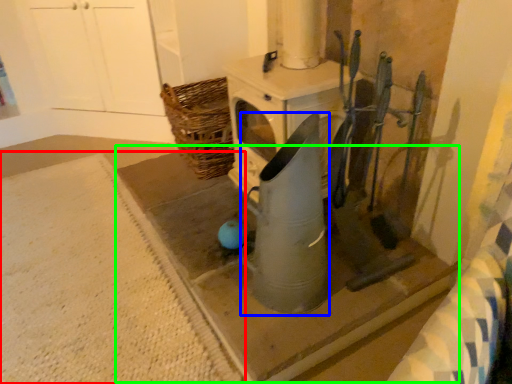
Question: Considering the real-world distances, which object is closest to concrete (highlighted by a red box)? appliance (highlighted by a blue box) or concrete (highlighted by a green box).

Choices:
 (A) appliance
 (B) concrete

Answer: (B)